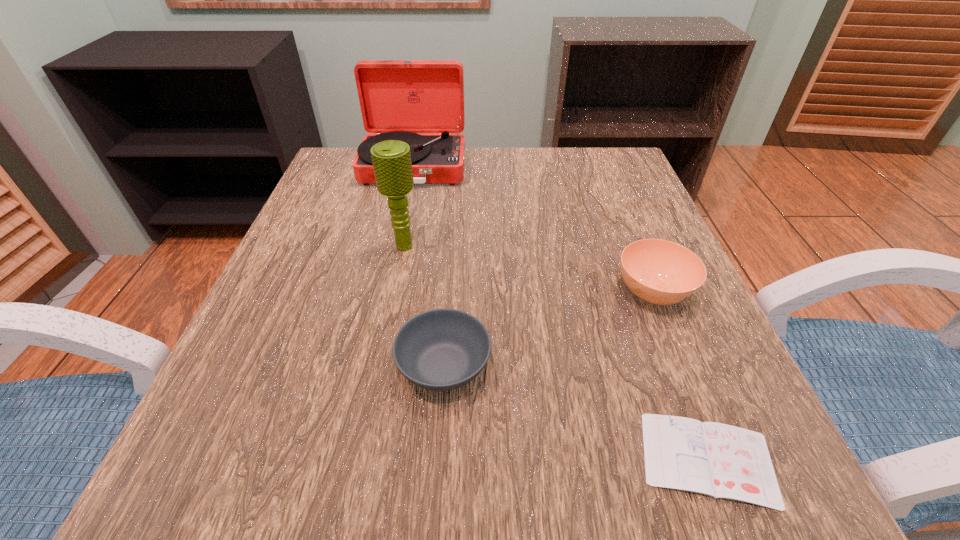
This screenshot has width=960, height=540. What are the coordinates of `free space between the shortest object and the microphone` in the screenshot? It's located at click(556, 353).

Locate an element on the screen. The height and width of the screenshot is (540, 960). free space between the fourth nearest object and the nearer soup bowl is located at coordinates (424, 306).

What are the coordinates of `free space that is in between the nearest object and the right soup bowl` in the screenshot? It's located at (681, 376).

Locate an element on the screen. empty space that is in between the third farthest object and the diary is located at coordinates (681, 376).

Locate an element on the screen. This screenshot has height=540, width=960. vacant area that lies between the taller soup bowl and the shortest object is located at coordinates (681, 376).

Identify the location of free space between the shortest object and the fourth tallest object. (576, 413).

Identify which object is the nearest to the microphone. Please provide its 2D coordinates. Your answer should be formatted as a tuple, i.e. [(x, y)], where the tuple contains the x and y coordinates of a point satisfying the conditions above.

[(398, 98)]

Find the location of `object that is the third closest to the third nearest object`. object that is the third closest to the third nearest object is located at coordinates (391, 159).

Where is `vacant region that satisfies the following two spatial constraints: 1. on the front-facing side of the farthest object; 2. on the left side of the microphone`? vacant region that satisfies the following two spatial constraints: 1. on the front-facing side of the farthest object; 2. on the left side of the microphone is located at coordinates (396, 246).

This screenshot has height=540, width=960. What are the coordinates of `free location that satisfies the following two spatial constraints: 1. on the front-facing side of the phonograph_record; 2. on the left side of the fourth nearest object` in the screenshot? It's located at (396, 246).